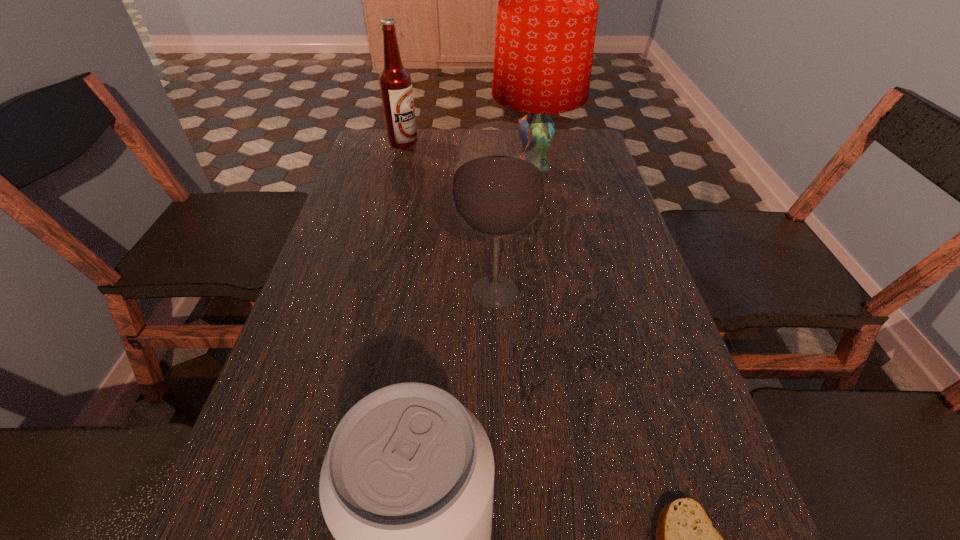
Identify the location of the tallest object. The image size is (960, 540). (546, 24).

The image size is (960, 540). Identify the location of the leftmost alcohol. (395, 82).

I want to click on the leftmost object, so click(395, 82).

You are a GUI agent. You are given a task and a screenshot of the screen. Output one action in this format:
    pyautogui.click(x=<x>, y=<y>)
    Task: Click on the third farthest object
    The height and width of the screenshot is (540, 960).
    Given the screenshot: What is the action you would take?
    pyautogui.click(x=498, y=188)

Find the location of a particular element. The height and width of the screenshot is (540, 960). vacant space located on the front-facing side of the lampshade is located at coordinates (547, 257).

Image resolution: width=960 pixels, height=540 pixels. Identify the location of vacant space positioned 0.270m on the label side of the leftmost object. (500, 142).

At what (x,y) coordinates should I click in order to perform the action: click on vacant point located 0.100m on the back of the second nearest alcohol. Please return your answer as a coordinate pair (x, y). This screenshot has width=960, height=540. Looking at the image, I should click on (493, 238).

Where is `lampshade that is at the far edge`? lampshade that is at the far edge is located at coordinates (546, 24).

The width and height of the screenshot is (960, 540). What are the coordinates of `alcohol at the far edge` in the screenshot? It's located at (395, 82).

The width and height of the screenshot is (960, 540). Find the location of `object present at the left edge`. object present at the left edge is located at coordinates (395, 82).